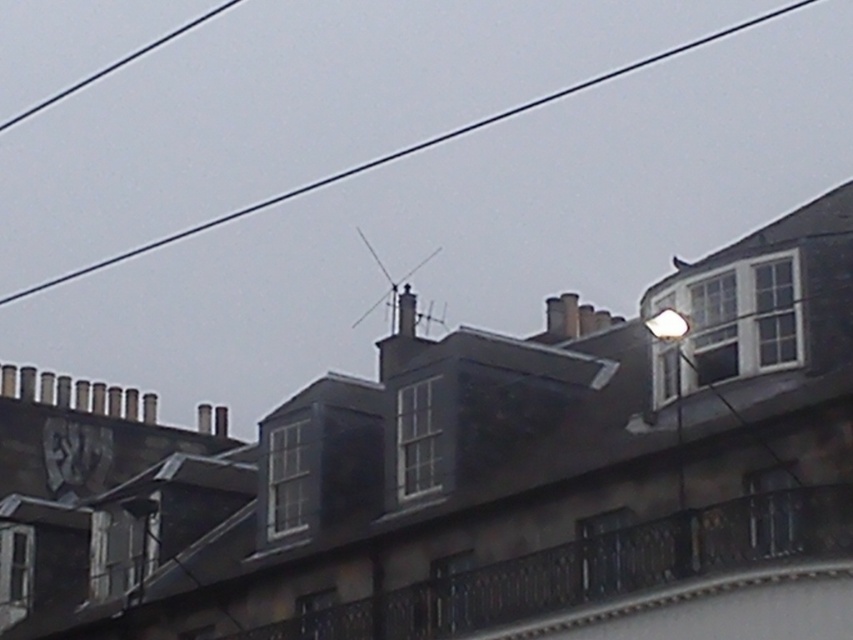
You are a maintenance worker needing to repair both the black wire at upper center and the metallic gray clock at upper left. Given that you have a ladder that can reach up to 150 meters, will you be able to reach both objects without moving the ladder?

The black wire at upper center and metallic gray clock at upper left are 159.71 meters apart from each other, so the ladder can only reach up to 150 meters. Therefore, you will not be able to reach both objects without moving the ladder.

You are an electrician inspecting the roof of a historic building. You notice the black wire at upper center and the smooth gray chimney at center. Which object is positioned to the left when viewed from the front of the building?

The black wire at upper center is to the left of the smooth gray chimney at center, so the black wire at upper center is positioned to the left.

You are an architect inspecting the building facade. You notice the metallic gray clock at upper left and the smooth gray chimney at center. Which object is located higher up on the building?

The metallic gray clock at upper left is positioned under the smooth gray chimney at center, so the smooth gray chimney at center is higher up on the building.